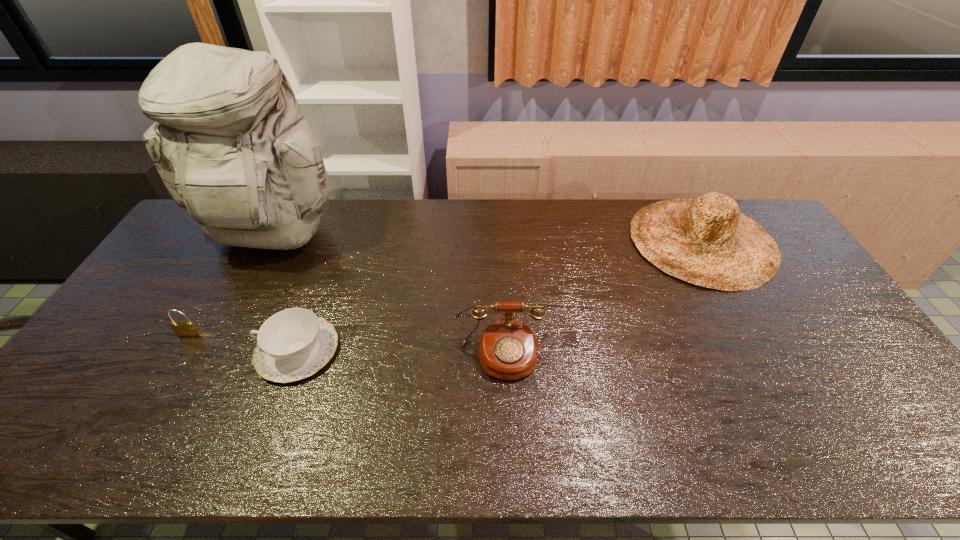
I want to click on free location located 0.160m on the handle side of the chinaware, so click(199, 350).

The image size is (960, 540). What are the coordinates of `free space located on the handle side of the chinaware` in the screenshot? It's located at (231, 350).

Find the location of a particular element. The image size is (960, 540). backpack located at the far edge is located at coordinates (230, 143).

This screenshot has width=960, height=540. Identify the location of sunhat that is at the far edge. (706, 241).

At what (x,y) coordinates should I click in order to perform the action: click on object that is at the left edge. Please return your answer as a coordinate pair (x, y). Looking at the image, I should click on (230, 143).

Find the location of a particular element. The width and height of the screenshot is (960, 540). object situated at the right edge is located at coordinates (706, 241).

Locate an element on the screen. object present at the far left corner is located at coordinates (230, 143).

Where is `object that is at the far right corner`? The image size is (960, 540). object that is at the far right corner is located at coordinates (706, 241).

In the image, there is a desktop. Where is `vacant space at the far edge`? The height and width of the screenshot is (540, 960). vacant space at the far edge is located at coordinates (620, 207).

Image resolution: width=960 pixels, height=540 pixels. In the image, there is a desktop. Identify the location of vacant space at the near edge. (207, 427).